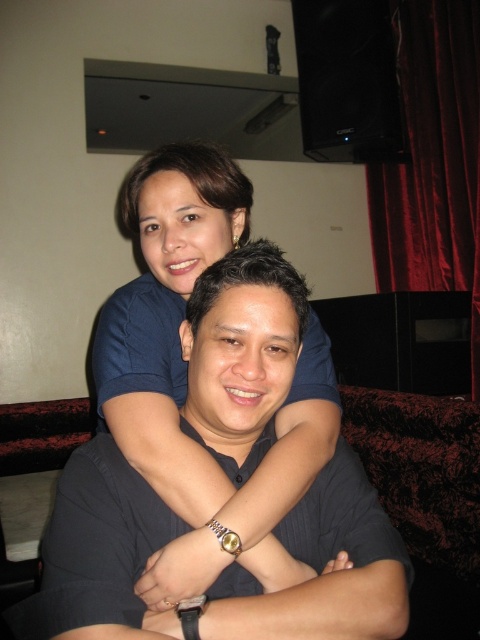
Does point (300, 460) lie behind point (421, 12)?

No, (300, 460) is closer to viewer.

Who is positioned more to the right, blue smooth shirt at upper center or velvet red curtain at upper right?

From the viewer's perspective, velvet red curtain at upper right appears more on the right side.

Who is more distant from viewer, [244,499] or [440,51]?

The point [440,51] is more distant.

Image resolution: width=480 pixels, height=640 pixels. I want to click on blue smooth shirt at upper center, so click(x=186, y=378).